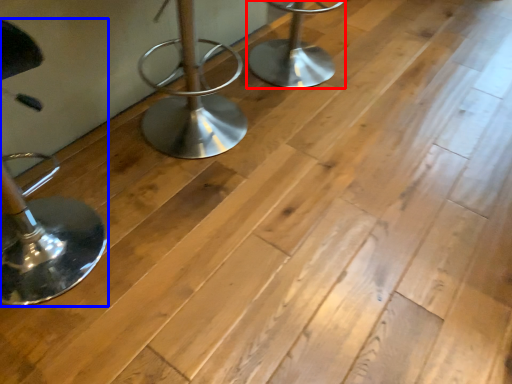
Question: Which object is further to the camera taking this photo, furniture (highlighted by a red box) or furniture (highlighted by a blue box)?

Choices:
 (A) furniture
 (B) furniture

Answer: (A)